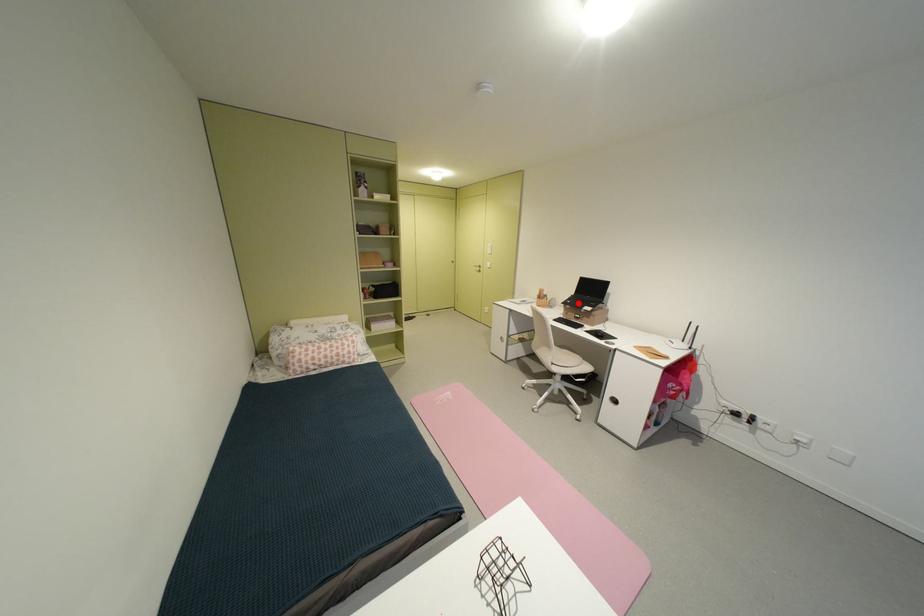
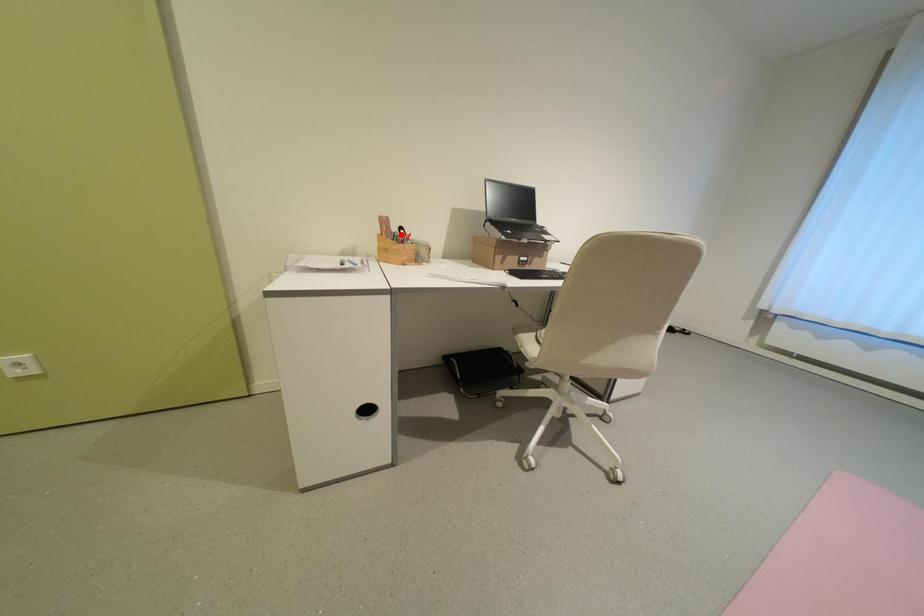
I am providing you with two images of the same scene from different viewpoints. A red point is marked on the first image and another point is marked on the second image. Do the highlighted points in image1 and image2 indicate the same real-world spot?

No